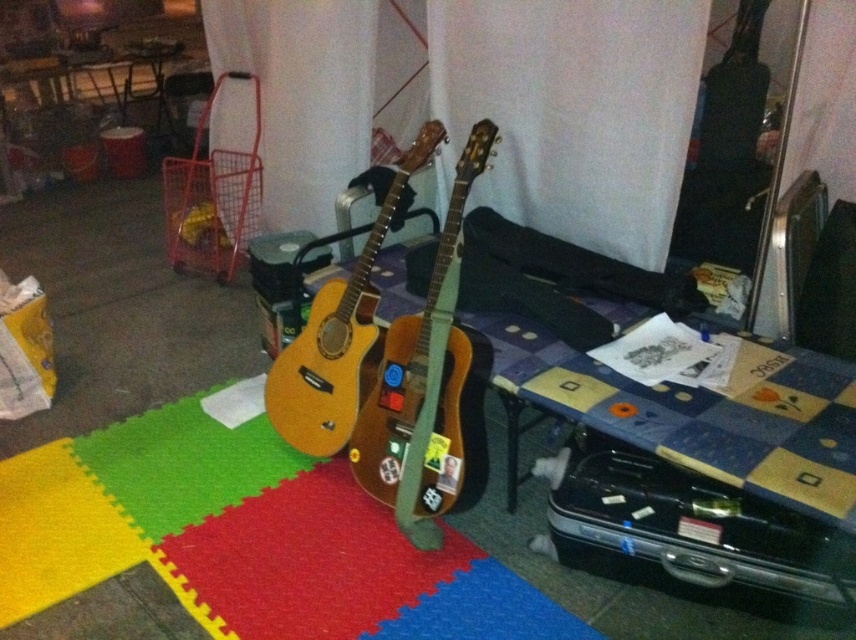
Question: Can you confirm if wooden acoustic guitar at center is positioned below yellow matte acoustic guitar at center?

Choices:
 (A) yes
 (B) no

Answer: (A)

Question: Which object is the closest to the wooden acoustic guitar at center?

Choices:
 (A) yellow matte acoustic guitar at center
 (B) black hard case at lower right

Answer: (A)

Question: Is black hard case at lower right above wooden acoustic guitar at center?

Choices:
 (A) yes
 (B) no

Answer: (B)

Question: Among these points, which one is nearest to the camera?

Choices:
 (A) (670, 486)
 (B) (385, 195)
 (C) (443, 502)

Answer: (A)

Question: Does wooden acoustic guitar at center appear under yellow matte acoustic guitar at center?

Choices:
 (A) no
 (B) yes

Answer: (B)

Question: Among these points, which one is farthest from the camera?

Choices:
 (A) [813, 556]
 (B) [274, 401]

Answer: (B)